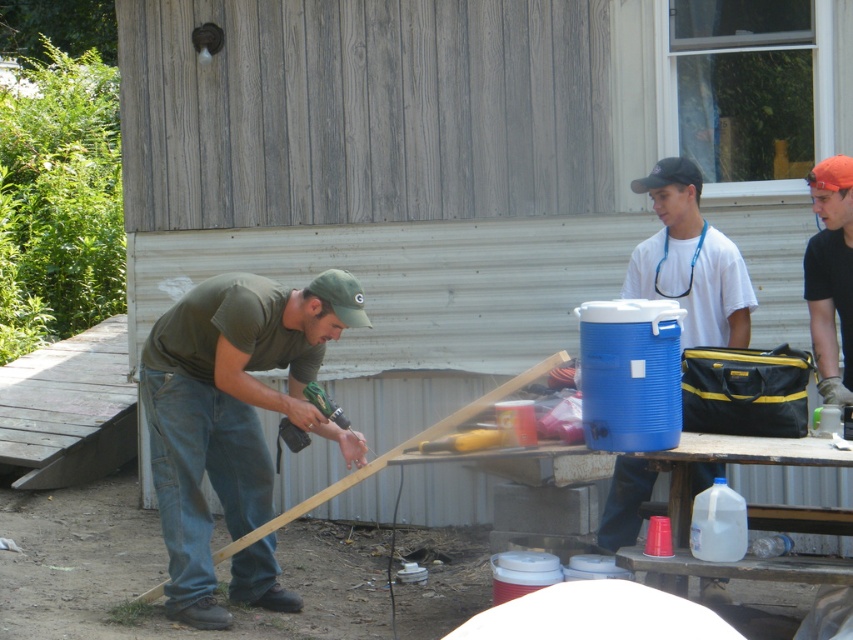
Question: Does white matte cooler at center appear under orange fabric cap at upper right?

Choices:
 (A) no
 (B) yes

Answer: (A)

Question: Among these points, which one is nearest to the camera?

Choices:
 (A) (x=822, y=200)
 (B) (x=192, y=301)

Answer: (A)

Question: Which point is farther to the camera?

Choices:
 (A) (178, 518)
 (B) (688, 273)
 (C) (817, 365)

Answer: (B)

Question: Is green matte shirt at center bigger than white matte cooler at center?

Choices:
 (A) no
 (B) yes

Answer: (B)

Question: Estimate the real-world distances between objects in this image. Which object is closer to the green matte shirt at center?

Choices:
 (A) orange fabric cap at upper right
 (B) white matte cooler at center

Answer: (B)

Question: Is green matte shirt at center below white matte cooler at center?

Choices:
 (A) yes
 (B) no

Answer: (A)